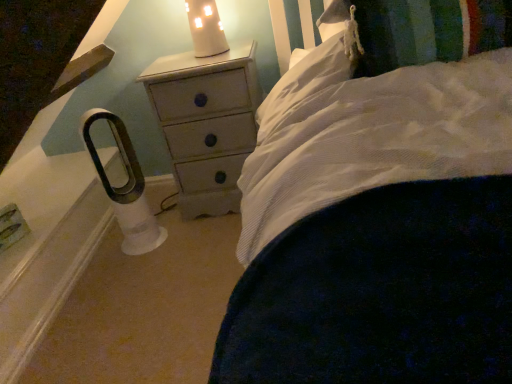
Image resolution: width=512 pixels, height=384 pixels. I want to click on free space on the front side of white painted wood chest of drawers at center, so click(x=200, y=254).